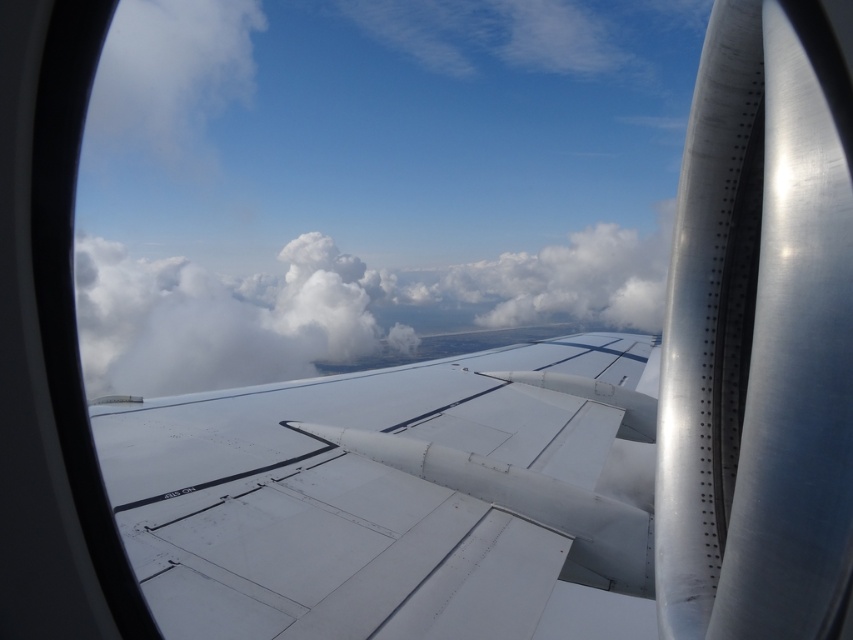
You are a passenger sitting by the window and want to know which object, the white matte wing at center or the white fluffy cloud at center, occupies more vertical space in the image. Based on their positions, which one is taller?

The white fluffy cloud at center is taller than the white matte wing at center.

You are a passenger sitting in an airplane seat and want to know how far the point at coordinates point (x=485, y=620) is from your current position. Can you determine the distance?

The point (x=485, y=620) is 6.88 feet away from the camera, so the distance from your current position to that point is approximately 6.88 feet.

You are a passenger sitting by the window of an airplane. You notice two points marked on the window at coordinates point (410, 376) and point (612, 289). Which point is nearer to your eyes?

Point (410, 376) is closer to the viewer than point (612, 289).